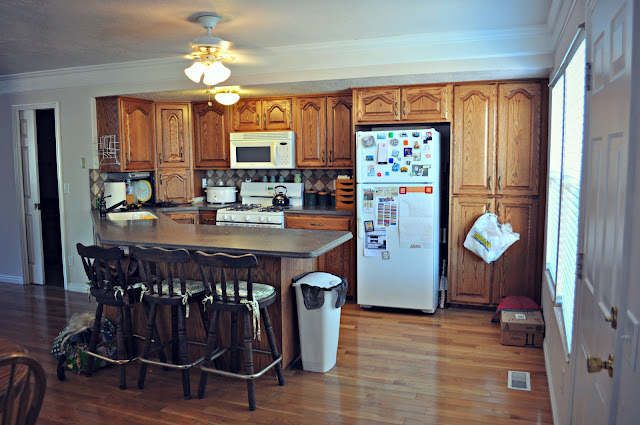
Locate an element on the screen. high top chair is located at coordinates (235, 256), (180, 256), (104, 256).